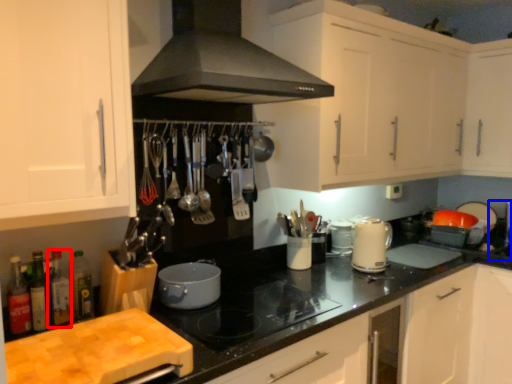
Question: Which object appears farthest to the camera in this image, bottle (highlighted by a red box) or sink (highlighted by a blue box)?

Choices:
 (A) bottle
 (B) sink

Answer: (B)